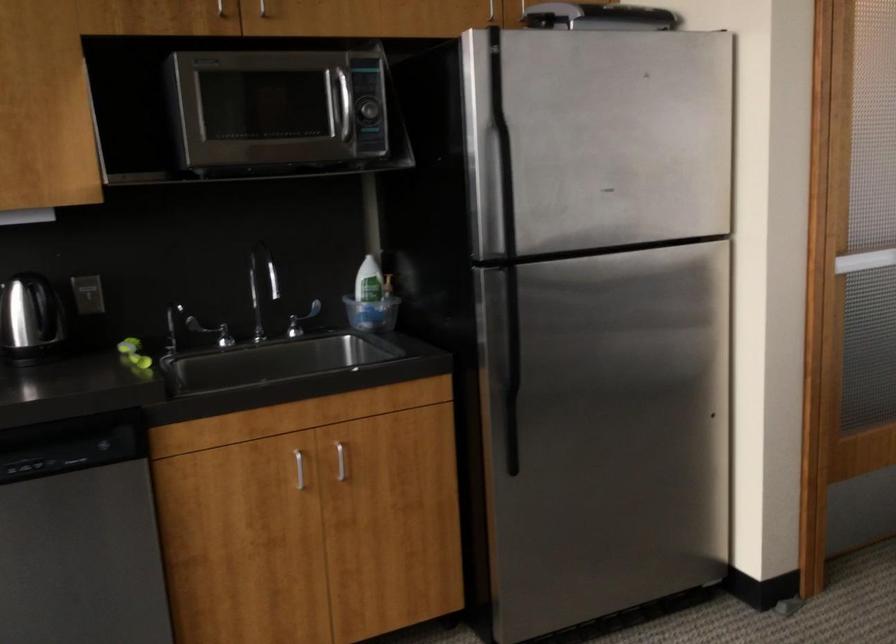
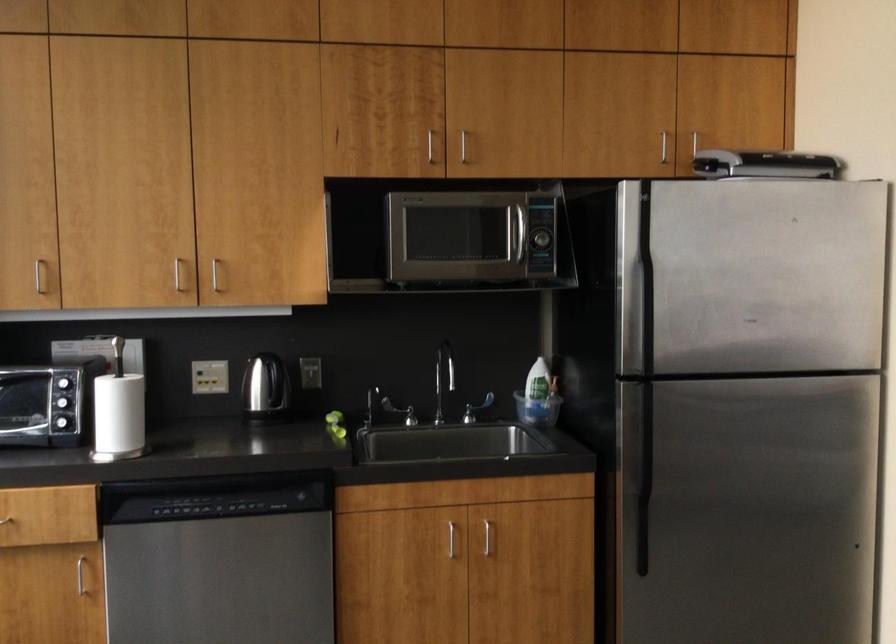
Where in the second image is the point corresponding to point (513, 375) from the first image?

(643, 480)